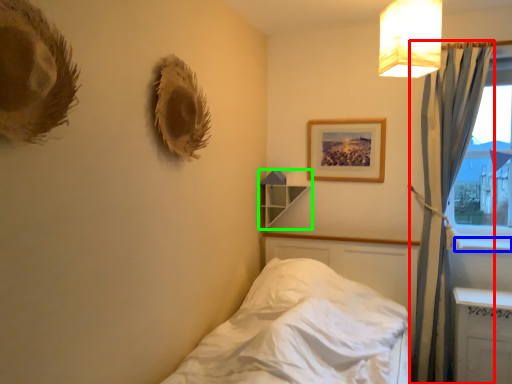
Question: Which is farther away from curtain (highlighted by a red box)? window sill (highlighted by a blue box) or shelf (highlighted by a green box)?

Choices:
 (A) window sill
 (B) shelf

Answer: (B)